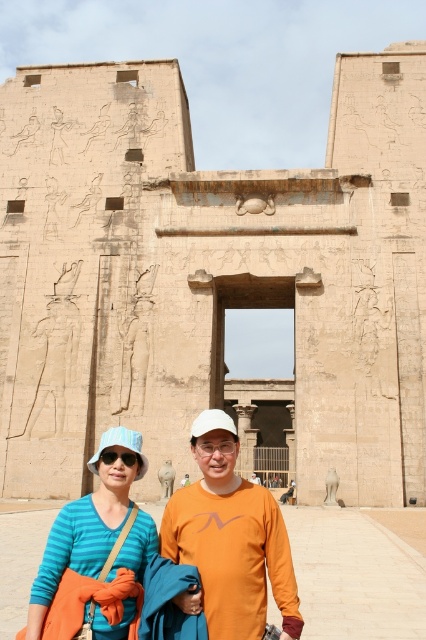
Question: Which object is the farthest from the blue striped shirt at center?

Choices:
 (A) orange matte shirt at center
 (B) beige stone temple at center

Answer: (B)

Question: Which object is positioned closest to the beige stone temple at center?

Choices:
 (A) orange matte shirt at center
 (B) blue striped shirt at center

Answer: (A)

Question: From the image, what is the correct spatial relationship of beige stone temple at center in relation to orange matte shirt at center?

Choices:
 (A) left
 (B) right

Answer: (A)

Question: Does beige stone temple at center come in front of orange matte shirt at center?

Choices:
 (A) no
 (B) yes

Answer: (A)

Question: Can you confirm if orange matte shirt at center is positioned above blue striped shirt at center?

Choices:
 (A) yes
 (B) no

Answer: (A)

Question: Which object is the closest to the blue striped shirt at center?

Choices:
 (A) orange matte shirt at center
 (B) beige stone temple at center

Answer: (A)